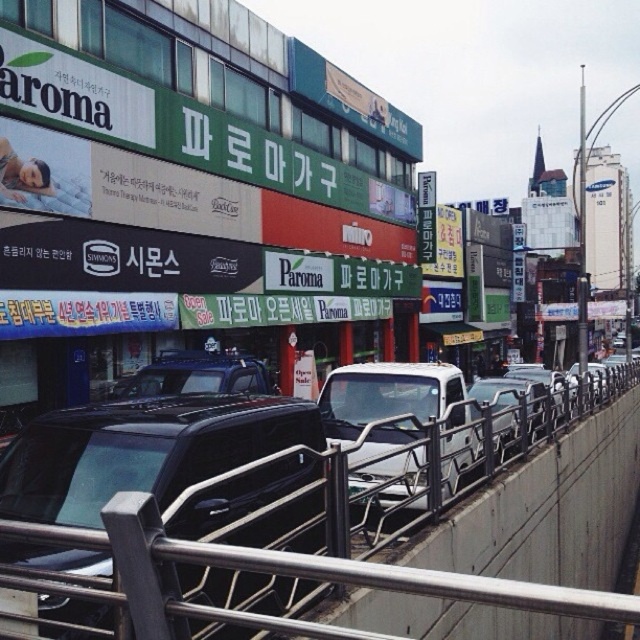
Question: Is metallic gray rail at center to the right of metallic blue truck at center from the viewer's perspective?

Choices:
 (A) no
 (B) yes

Answer: (B)

Question: Which is nearer to the metallic gray rail at center?

Choices:
 (A) metallic blue truck at center
 (B) white matte truck at center
 (C) metallic silver truck at center
 (D) black matte car at center

Answer: (D)

Question: Does white matte truck at center have a larger size compared to metallic blue truck at center?

Choices:
 (A) yes
 (B) no

Answer: (B)

Question: Does white matte truck at center appear over metallic silver truck at center?

Choices:
 (A) yes
 (B) no

Answer: (B)

Question: Which point is farther to the camera?

Choices:
 (A) (24, 588)
 (B) (45, 420)

Answer: (B)

Question: Which point is closer to the camera?

Choices:
 (A) (493, 435)
 (B) (253, 358)
 (C) (262, 488)

Answer: (C)